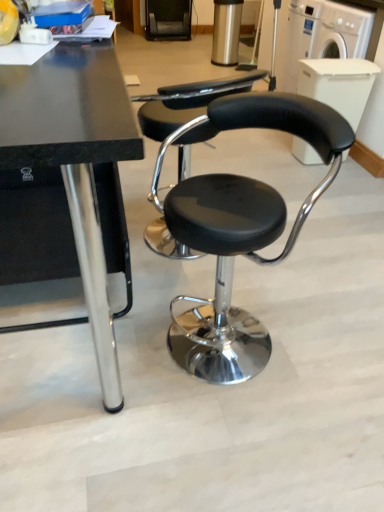
Question: Does white plastic washing machine at upper right, which ranks as the first washing machine in bottom-to-top order, have a greater height compared to white plastic washing machine at upper right, which appears as the second washing machine when ordered from the bottom?

Choices:
 (A) yes
 (B) no

Answer: (B)

Question: Can you confirm if white plastic washing machine at upper right, which is the 2th washing machine from top to bottom, is bigger than white plastic washing machine at upper right, the 1th washing machine when ordered from top to bottom?

Choices:
 (A) yes
 (B) no

Answer: (B)

Question: Is white plastic washing machine at upper right, which ranks as the first washing machine in bottom-to-top order, directly adjacent to white plastic washing machine at upper right, the 1th washing machine when ordered from top to bottom?

Choices:
 (A) no
 (B) yes

Answer: (A)

Question: Can you confirm if white plastic washing machine at upper right, which is the 2th washing machine from top to bottom, is smaller than white plastic washing machine at upper right, the 1th washing machine when ordered from top to bottom?

Choices:
 (A) no
 (B) yes

Answer: (B)

Question: Can you confirm if white plastic washing machine at upper right, which ranks as the first washing machine in bottom-to-top order, is thinner than white plastic washing machine at upper right, the 1th washing machine when ordered from top to bottom?

Choices:
 (A) no
 (B) yes

Answer: (B)

Question: Is black leather stool at center in front of or behind black polished wood table at center in the image?

Choices:
 (A) front
 (B) behind

Answer: (B)

Question: From the image's perspective, relative to black polished wood table at center, is black leather stool at center above or below?

Choices:
 (A) below
 (B) above

Answer: (A)

Question: In terms of width, does black leather stool at center look wider or thinner when compared to black polished wood table at center?

Choices:
 (A) thin
 (B) wide

Answer: (A)

Question: From a real-world perspective, is black leather stool at center above or below black polished wood table at center?

Choices:
 (A) below
 (B) above

Answer: (A)

Question: Considering the positions of white plastic washing machine at upper right, which appears as the second washing machine when ordered from the bottom, and white plastic washing machine at upper right, which ranks as the first washing machine in bottom-to-top order, in the image, is white plastic washing machine at upper right, which appears as the second washing machine when ordered from the bottom, wider or thinner than white plastic washing machine at upper right, which ranks as the first washing machine in bottom-to-top order,?

Choices:
 (A) wide
 (B) thin

Answer: (A)

Question: Does point (336, 22) appear closer or farther from the camera than point (324, 10)?

Choices:
 (A) closer
 (B) farther

Answer: (A)

Question: From a real-world perspective, is white plastic washing machine at upper right, which appears as the second washing machine when ordered from the bottom, positioned above or below white plastic washing machine at upper right, which ranks as the first washing machine in bottom-to-top order?

Choices:
 (A) below
 (B) above

Answer: (A)

Question: From the image's perspective, is white plastic washing machine at upper right, which appears as the second washing machine when ordered from the bottom, above or below white plastic washing machine at upper right, which is the 2th washing machine from top to bottom?

Choices:
 (A) above
 (B) below

Answer: (A)

Question: From a real-world perspective, is black leather stool at center above or below white plastic washing machine at upper right, which appears as the second washing machine when ordered from the bottom?

Choices:
 (A) below
 (B) above

Answer: (A)

Question: Looking at their shapes, would you say black leather stool at center is wider or thinner than white plastic washing machine at upper right, the 1th washing machine when ordered from top to bottom?

Choices:
 (A) thin
 (B) wide

Answer: (A)